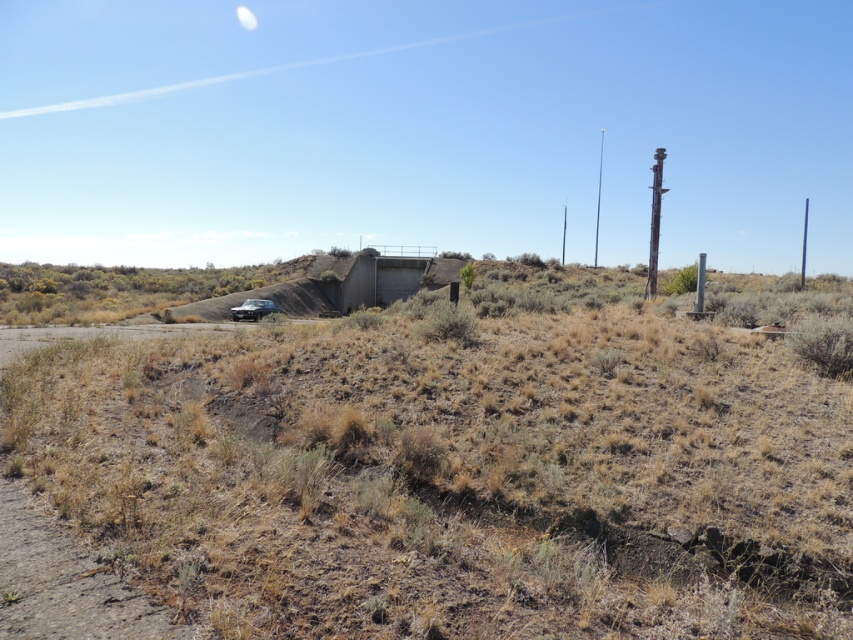
How distant is weathered wood telegraph pole at right from metallic silver car at center?

weathered wood telegraph pole at right and metallic silver car at center are 28.39 meters apart.

Does weathered wood telegraph pole at right appear over metallic silver car at center?

Yes, weathered wood telegraph pole at right is above metallic silver car at center.

Between point (654, 276) and point (270, 310), which one is positioned in front?

Point (654, 276) is in front.

The width and height of the screenshot is (853, 640). Find the location of `weathered wood telegraph pole at right`. weathered wood telegraph pole at right is located at coordinates (654, 221).

Looking at this image, is metallic silver car at center closer to camera compared to wooden telegraph pole at right?

Yes.

Can you confirm if metallic silver car at center is positioned to the right of wooden telegraph pole at right?

In fact, metallic silver car at center is to the left of wooden telegraph pole at right.

Is point (254, 314) positioned behind point (595, 225)?

No, it is in front of (595, 225).

At what (x,y) coordinates should I click in order to perform the action: click on metallic silver car at center. Please return your answer as a coordinate pair (x, y). The height and width of the screenshot is (640, 853). Looking at the image, I should click on (253, 308).

How far apart are weathered wood telegraph pole at right and wooden telegraph pole at right?

The distance of weathered wood telegraph pole at right from wooden telegraph pole at right is 39.35 meters.

What do you see at coordinates (654, 221) in the screenshot? This screenshot has width=853, height=640. I see `weathered wood telegraph pole at right` at bounding box center [654, 221].

This screenshot has width=853, height=640. I want to click on weathered wood telegraph pole at right, so click(x=654, y=221).